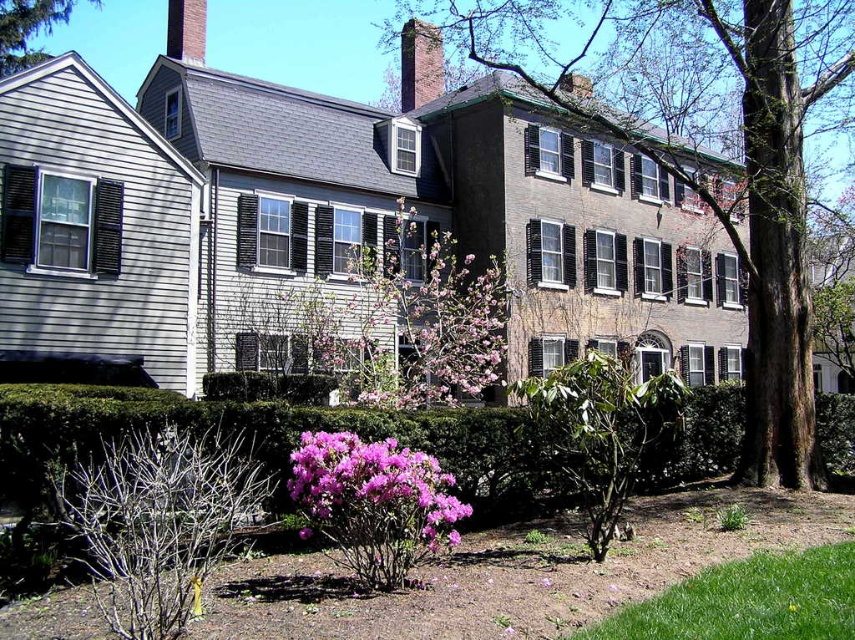
You are standing in the front yard of the house and see the green leafy hedge at lower center and the pink bloom at center. Which object is closer to the ground?

The green leafy hedge at lower center is closer to the ground because it is positioned below the pink bloom at center.

You are a gardener who wants to plant a new flower bed. You notice the pink bloom at center and the brown wood tree at upper left in the scene. Which object is wider?

The pink bloom at center is narrower than the brown wood tree at upper left, so the brown wood tree at upper left is wider.

You are standing in the front yard of the house and want to plant a new flower bed. There is a green leafy hedge at lower center located at point [270,436]. Where exactly should you place the flower bed to ensure it is not too close to the hedge?

The green leafy hedge at lower center is located at point [270,436]. To avoid placing the flower bed too close, you should position it at least 1 meter away from this point.